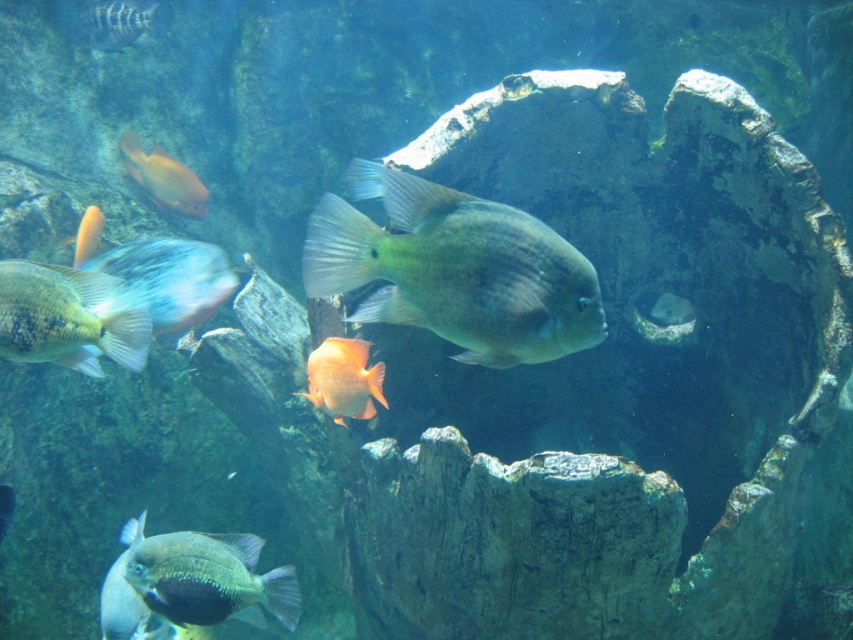
Question: Which point is farther to the camera?

Choices:
 (A) shiny blue fish at center
 (B) green matte fish at center

Answer: (A)

Question: Which point is farther from the camera taking this photo?

Choices:
 (A) (97, 323)
 (B) (93, 227)
 (C) (129, 256)
 (D) (376, 364)

Answer: (B)

Question: Is green matte fish at center to the left of shiny blue fish at center from the viewer's perspective?

Choices:
 (A) yes
 (B) no

Answer: (B)

Question: Can you confirm if shiny blue fish at center is wider than orange matte fish at center?

Choices:
 (A) no
 (B) yes

Answer: (B)

Question: From the image, what is the correct spatial relationship of orange matte fish at upper left in relation to shiny silver fish at upper left?

Choices:
 (A) below
 (B) above

Answer: (A)

Question: Which of these objects is positioned closest to the orange matte fish at left?

Choices:
 (A) orange matte fish at upper left
 (B) speckled blue fish at left
 (C) shiny blue fish at center
 (D) shiny blue fish at lower left

Answer: (C)